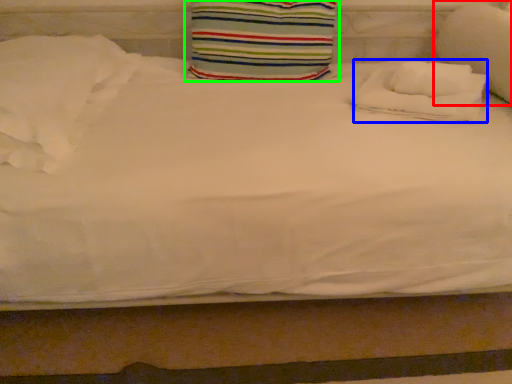
Question: Based on their relative distances, which object is farther from pillow (highlighted by a red box)? Choose from pillow (highlighted by a blue box) and pillow (highlighted by a green box).

Choices:
 (A) pillow
 (B) pillow

Answer: (B)